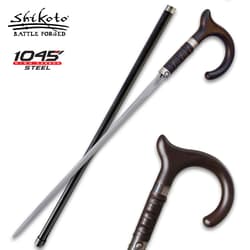
I want to click on handle, so click(211, 24), click(179, 161).